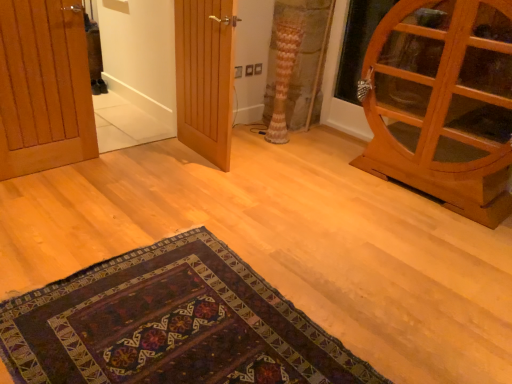
The width and height of the screenshot is (512, 384). What do you see at coordinates (44, 87) in the screenshot?
I see `wooden door at left, placed as the third door when sorted from right to left` at bounding box center [44, 87].

The width and height of the screenshot is (512, 384). Describe the element at coordinates (284, 71) in the screenshot. I see `patterned fabric curtain at center` at that location.

Image resolution: width=512 pixels, height=384 pixels. Describe the element at coordinates (443, 103) in the screenshot. I see `wooden cabinet at right, which is counted as the 3th door, starting from the left` at that location.

At what (x,y) coordinates should I click in order to perform the action: click on wooden door at left, placed as the third door when sorted from right to left. Please return your answer as a coordinate pair (x, y). The height and width of the screenshot is (384, 512). Looking at the image, I should click on (44, 87).

Is wooden cabinet at right, which is counted as the 3th door, starting from the left, oriented towards patterned fabric curtain at center?

No, wooden cabinet at right, which is counted as the 3th door, starting from the left, is not aimed at patterned fabric curtain at center.

Considering the sizes of objects wooden cabinet at right, positioned as the 1th door in right-to-left order, and patterned fabric curtain at center in the image provided, who is thinner, wooden cabinet at right, positioned as the 1th door in right-to-left order, or patterned fabric curtain at center?

With smaller width is patterned fabric curtain at center.

Considering the relative sizes of wooden cabinet at right, which is counted as the 3th door, starting from the left, and patterned fabric curtain at center in the image provided, is wooden cabinet at right, which is counted as the 3th door, starting from the left, shorter than patterned fabric curtain at center?

Incorrect, the height of wooden cabinet at right, which is counted as the 3th door, starting from the left, does not fall short of that of patterned fabric curtain at center.

Is point (247, 317) positioned before point (228, 91)?

Yes, point (247, 317) is closer to viewer.

From the image's perspective, relative to wooden door at center, the 2th door when ordered from left to right, is dark woven rug at lower center above or below?

dark woven rug at lower center is below wooden door at center, the 2th door when ordered from left to right.

Considering the relative sizes of dark woven rug at lower center and wooden door at center, the 2th door when ordered from left to right, in the image provided, is dark woven rug at lower center taller than wooden door at center, the 2th door when ordered from left to right,?

No.

From the image's perspective, is dark woven rug at lower center under wooden door at left, placed as the third door when sorted from right to left?

Yes, from the image's perspective, dark woven rug at lower center is beneath wooden door at left, placed as the third door when sorted from right to left.

Considering the relative sizes of dark woven rug at lower center and wooden door at left, placed as the third door when sorted from right to left, in the image provided, is dark woven rug at lower center smaller than wooden door at left, placed as the third door when sorted from right to left,?

No, dark woven rug at lower center is not smaller than wooden door at left, placed as the third door when sorted from right to left.

You are a GUI agent. You are given a task and a screenshot of the screen. Output one action in this format:
    pyautogui.click(x=<x>, y=<y>)
    Task: Click on the mat on the right of wooden door at left, placed as the third door when sorted from right to left
    Image resolution: width=512 pixels, height=384 pixels.
    Given the screenshot: What is the action you would take?
    pyautogui.click(x=170, y=325)

In the scene shown: From a real-world perspective, is wooden door at left, placed as the third door when sorted from right to left, beneath wooden cabinet at right, positioned as the 1th door in right-to-left order?

Yes, from a real-world perspective, wooden door at left, placed as the third door when sorted from right to left, is below wooden cabinet at right, positioned as the 1th door in right-to-left order.

Is wooden door at left, placed as the third door when sorted from right to left, facing towards wooden cabinet at right, which is counted as the 3th door, starting from the left?

No, wooden door at left, placed as the third door when sorted from right to left, is not aimed at wooden cabinet at right, which is counted as the 3th door, starting from the left.

Is point (50, 122) closer to camera compared to point (388, 22)?

No, it is not.

Which object is further away from the camera taking this photo, wooden door at left, the 1th door from the left, or wooden cabinet at right, which is counted as the 3th door, starting from the left?

wooden door at left, the 1th door from the left, is further from the camera.

Which of these two, patterned fabric curtain at center or wooden door at center, the second door in the right-to-left sequence, is bigger?

wooden door at center, the second door in the right-to-left sequence, is bigger.

Between patterned fabric curtain at center and wooden door at center, the second door in the right-to-left sequence, which one has more height?

With more height is wooden door at center, the second door in the right-to-left sequence.

From the image's perspective, is patterned fabric curtain at center above or below wooden door at center, the second door in the right-to-left sequence?

Based on their image positions, patterned fabric curtain at center is located above wooden door at center, the second door in the right-to-left sequence.

Is wooden door at center, the second door in the right-to-left sequence, to the left or to the right of wooden door at left, placed as the third door when sorted from right to left, in the image?

wooden door at center, the second door in the right-to-left sequence, is to the right of wooden door at left, placed as the third door when sorted from right to left.

From a real-world perspective, which is physically below, wooden door at center, the 2th door when ordered from left to right, or wooden door at left, the 1th door from the left?

wooden door at left, the 1th door from the left, is physically lower.

Can you tell me how much wooden door at center, the 2th door when ordered from left to right, and wooden door at left, the 1th door from the left, differ in facing direction?

The facing directions of wooden door at center, the 2th door when ordered from left to right, and wooden door at left, the 1th door from the left, are 93.1 degrees apart.

At what (x,y) coordinates should I click in order to perform the action: click on door located underneath the wooden door at center, the second door in the right-to-left sequence (from a real-world perspective). Please return your answer as a coordinate pair (x, y). Image resolution: width=512 pixels, height=384 pixels. Looking at the image, I should click on click(44, 87).

Is patterned fabric curtain at center surrounding wooden door at left, the 1th door from the left?

No, wooden door at left, the 1th door from the left, is not inside patterned fabric curtain at center.

Between patterned fabric curtain at center and wooden door at left, placed as the third door when sorted from right to left, which one appears on the left side from the viewer's perspective?

wooden door at left, placed as the third door when sorted from right to left, is more to the left.

From a real-world perspective, which object stands above the other?

wooden door at left, placed as the third door when sorted from right to left.

Considering the sizes of patterned fabric curtain at center and wooden door at left, placed as the third door when sorted from right to left, in the image, is patterned fabric curtain at center taller or shorter than wooden door at left, placed as the third door when sorted from right to left,?

patterned fabric curtain at center is shorter than wooden door at left, placed as the third door when sorted from right to left.

Which door is the 3rd one when counting from the front of the patterned fabric curtain at center? Please provide its 2D coordinates.

[(443, 103)]

From the dark woven rug at lower center, count 3rd doors backward and point to it. Please provide its 2D coordinates.

[(205, 77)]

Estimate the real-world distances between objects in this image. Which object is closer to wooden door at center, the 2th door when ordered from left to right, dark woven rug at lower center or patterned fabric curtain at center?

Among the two, patterned fabric curtain at center is located nearer to wooden door at center, the 2th door when ordered from left to right.

Considering their positions, is wooden cabinet at right, which is counted as the 3th door, starting from the left, positioned closer to wooden door at left, the 1th door from the left, than wooden door at center, the second door in the right-to-left sequence?

The object closer to wooden door at left, the 1th door from the left, is wooden door at center, the second door in the right-to-left sequence.

From the image, which object appears to be nearer to wooden cabinet at right, positioned as the 1th door in right-to-left order, wooden door at center, the second door in the right-to-left sequence, or patterned fabric curtain at center?

patterned fabric curtain at center lies closer to wooden cabinet at right, positioned as the 1th door in right-to-left order, than the other object.

Which object lies further to the anchor point wooden door at center, the 2th door when ordered from left to right, patterned fabric curtain at center or dark woven rug at lower center?

dark woven rug at lower center lies further to wooden door at center, the 2th door when ordered from left to right, than the other object.

Based on their spatial positions, is wooden door at left, the 1th door from the left, or wooden door at center, the second door in the right-to-left sequence, further from wooden cabinet at right, positioned as the 1th door in right-to-left order?

wooden door at left, the 1th door from the left.

Estimate the real-world distances between objects in this image. Which object is closer to patterned fabric curtain at center, wooden door at center, the second door in the right-to-left sequence, or dark woven rug at lower center?

wooden door at center, the second door in the right-to-left sequence, is positioned closer to the anchor patterned fabric curtain at center.

Based on their spatial positions, is wooden cabinet at right, which is counted as the 3th door, starting from the left, or wooden door at center, the 2th door when ordered from left to right, closer to patterned fabric curtain at center?

wooden door at center, the 2th door when ordered from left to right.

Considering their positions, is wooden door at left, the 1th door from the left, positioned closer to patterned fabric curtain at center than wooden cabinet at right, which is counted as the 3th door, starting from the left?

Based on the image, wooden cabinet at right, which is counted as the 3th door, starting from the left, appears to be nearer to patterned fabric curtain at center.

The height and width of the screenshot is (384, 512). I want to click on door between wooden door at left, placed as the third door when sorted from right to left, and wooden cabinet at right, which is counted as the 3th door, starting from the left, from left to right, so (x=205, y=77).

Locate an element on the screen. curtain located between wooden door at left, placed as the third door when sorted from right to left, and wooden cabinet at right, which is counted as the 3th door, starting from the left, in the left-right direction is located at coordinates (284, 71).

Find the location of a particular element. This screenshot has width=512, height=384. door between wooden door at left, the 1th door from the left, and patterned fabric curtain at center from left to right is located at coordinates (205, 77).

The image size is (512, 384). I want to click on curtain situated between wooden door at center, the 2th door when ordered from left to right, and wooden cabinet at right, which is counted as the 3th door, starting from the left, from left to right, so click(x=284, y=71).